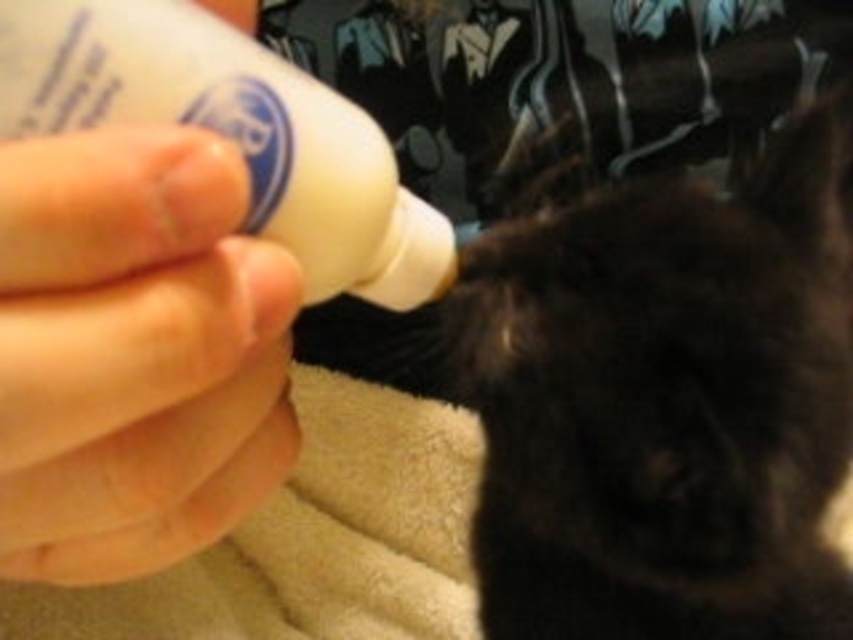
Based on the photo, you are a veterinarian examining the feeding setup for the black fur cat at center and the white plastic bottle at upper left. Based on their sizes, can the cat comfortably drink from the bottle without needing to stretch too much?

The black fur cat at center is taller than the white plastic bottle at upper left, so the cat can comfortably drink from the bottle without needing to stretch too much as its height allows easy access.

You are a veterinarian observing a feeding session. You notice the black fur cat at center and the white plastic bottle at upper left. Based on their positions, which object is closer to the left side of the image?

The white plastic bottle at upper left is closer to the left side of the image because the black fur cat at center is positioned to its right.